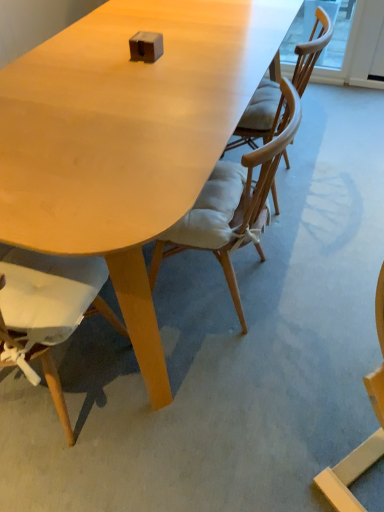
Question: Does wooden chair with cushion at center, placed as the 1th chair when sorted from right to left, appear on the left side of matte wood table at center?

Choices:
 (A) no
 (B) yes

Answer: (B)

Question: Does wooden chair with cushion at center, positioned as the third chair in left-to-right order, have a larger size compared to matte wood table at center?

Choices:
 (A) no
 (B) yes

Answer: (B)

Question: From a real-world perspective, is wooden chair with cushion at center, positioned as the third chair in left-to-right order, physically below matte wood table at center?

Choices:
 (A) no
 (B) yes

Answer: (A)

Question: Is wooden chair with cushion at center, positioned as the third chair in left-to-right order, wider than matte wood table at center?

Choices:
 (A) yes
 (B) no

Answer: (B)

Question: Can we say wooden chair with cushion at center, placed as the 1th chair when sorted from right to left, lies outside matte wood table at center?

Choices:
 (A) yes
 (B) no

Answer: (A)

Question: Is wooden chair with cushion at center, positioned as the third chair in left-to-right order, situated inside matte wood table at center or outside?

Choices:
 (A) inside
 (B) outside

Answer: (B)

Question: Based on their positions, is wooden chair with cushion at center, placed as the 1th chair when sorted from right to left, located to the left or right of matte wood table at center?

Choices:
 (A) right
 (B) left

Answer: (B)

Question: From a real-world perspective, is wooden chair with cushion at center, positioned as the third chair in left-to-right order, positioned above or below matte wood table at center?

Choices:
 (A) above
 (B) below

Answer: (A)

Question: In the image, is wooden chair with cushion at center, positioned as the third chair in left-to-right order, positioned in front of or behind matte wood table at center?

Choices:
 (A) front
 (B) behind

Answer: (B)

Question: Do you think light brown wood chair at center, which is counted as the 2th chair, starting from the right, is within matte wood chair at lower left, the first chair from the left, or outside of it?

Choices:
 (A) inside
 (B) outside

Answer: (B)

Question: From a real-world perspective, is light brown wood chair at center, which is counted as the second chair, starting from the left, physically located above or below matte wood chair at lower left, marked as the third chair in a right-to-left arrangement?

Choices:
 (A) above
 (B) below

Answer: (B)

Question: From their relative heights in the image, would you say light brown wood chair at center, which is counted as the second chair, starting from the left, is taller or shorter than matte wood chair at lower left, the first chair from the left?

Choices:
 (A) short
 (B) tall

Answer: (A)

Question: From the image's perspective, is light brown wood chair at center, which is counted as the 2th chair, starting from the right, above or below matte wood chair at lower left, marked as the third chair in a right-to-left arrangement?

Choices:
 (A) above
 (B) below

Answer: (A)

Question: Considering the positions of matte wood table at center and matte wood chair at lower left, the first chair from the left, in the image, is matte wood table at center taller or shorter than matte wood chair at lower left, the first chair from the left,?

Choices:
 (A) short
 (B) tall

Answer: (A)

Question: From a real-world perspective, relative to matte wood chair at lower left, marked as the third chair in a right-to-left arrangement, is matte wood table at center vertically above or below?

Choices:
 (A) below
 (B) above

Answer: (A)